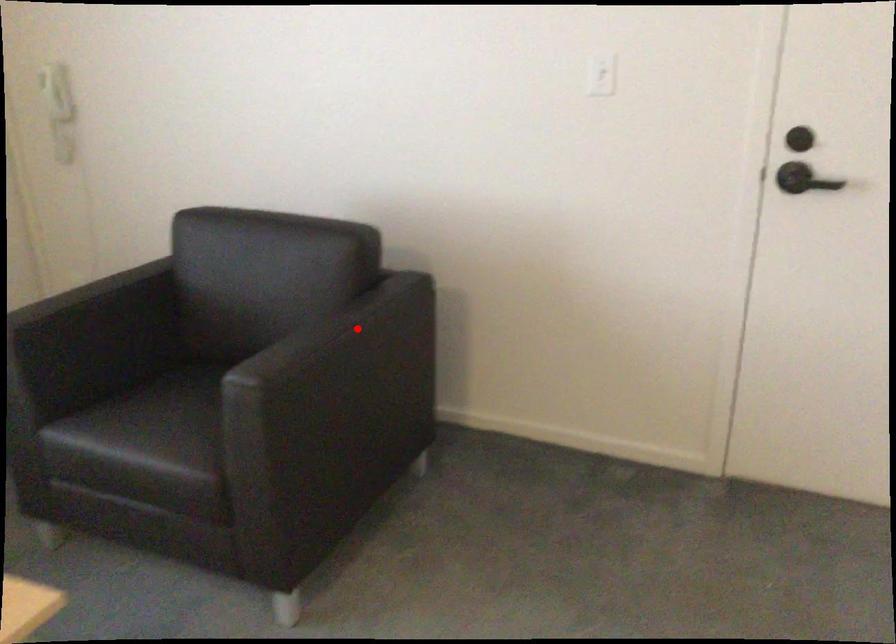
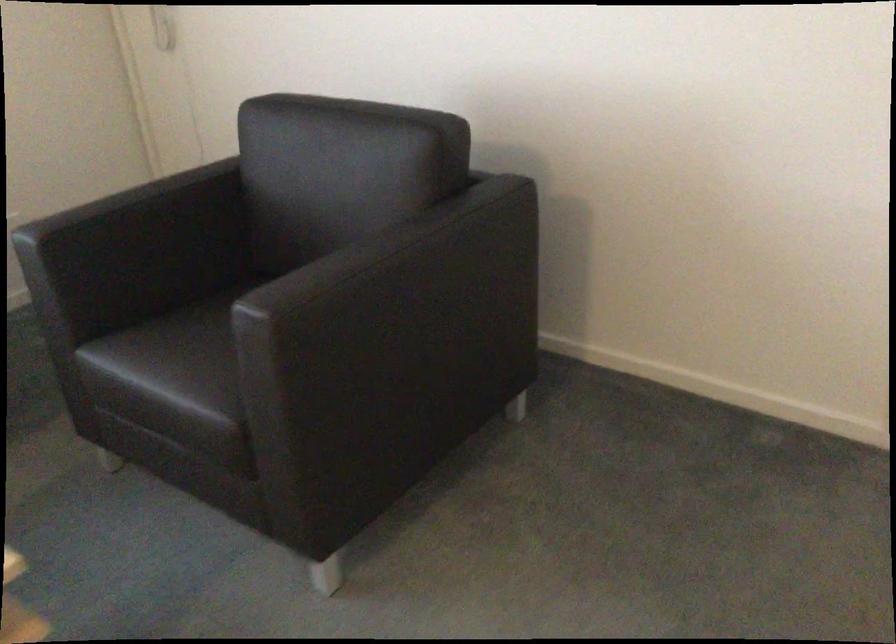
Question: A red point is marked in image1. In image2, is the corresponding 3D point closer to the camera or farther? Reply with the corresponding letter.

Choices:
 (A) The corresponding 3D point is closer.
 (B) The corresponding 3D point is farther.

Answer: (A)